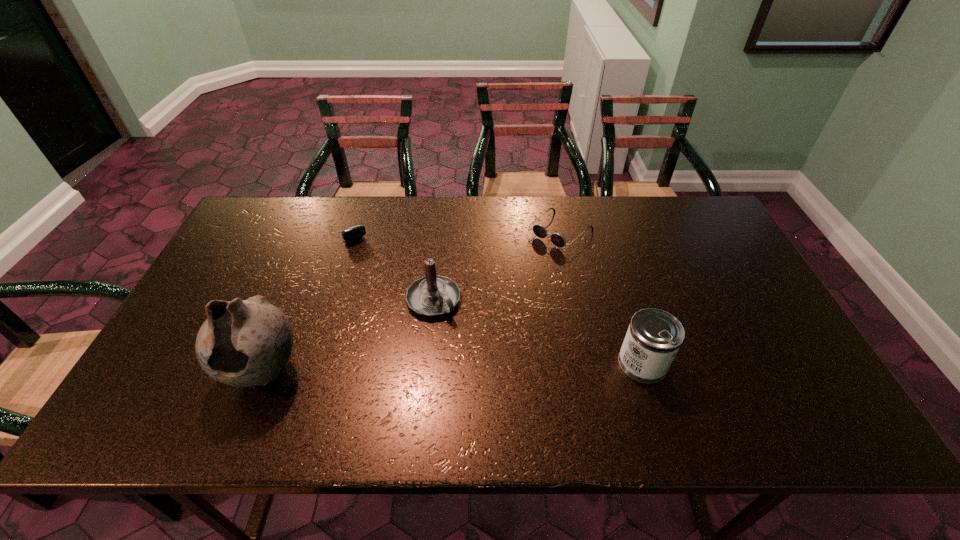
In order to click on free space on the desktop that is between the tallest object and the can and is positioned on the front-facing side of the sunglasses in this screenshot , I will do `click(405, 368)`.

Identify the location of free space on the desktop that is between the pottery and the can and is positioned on the front-facing side of the webcam. (439, 367).

Locate an element on the screen. This screenshot has width=960, height=540. free space on the desktop that is between the pottery and the can and is positioned on the side of the third farthest object with the handle loop is located at coordinates (492, 366).